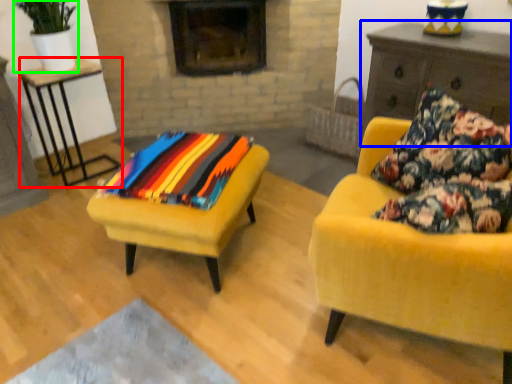
Question: Which is nearer to the table (highlighted by a red box)? dresser (highlighted by a blue box) or houseplant (highlighted by a green box).

Choices:
 (A) dresser
 (B) houseplant

Answer: (B)